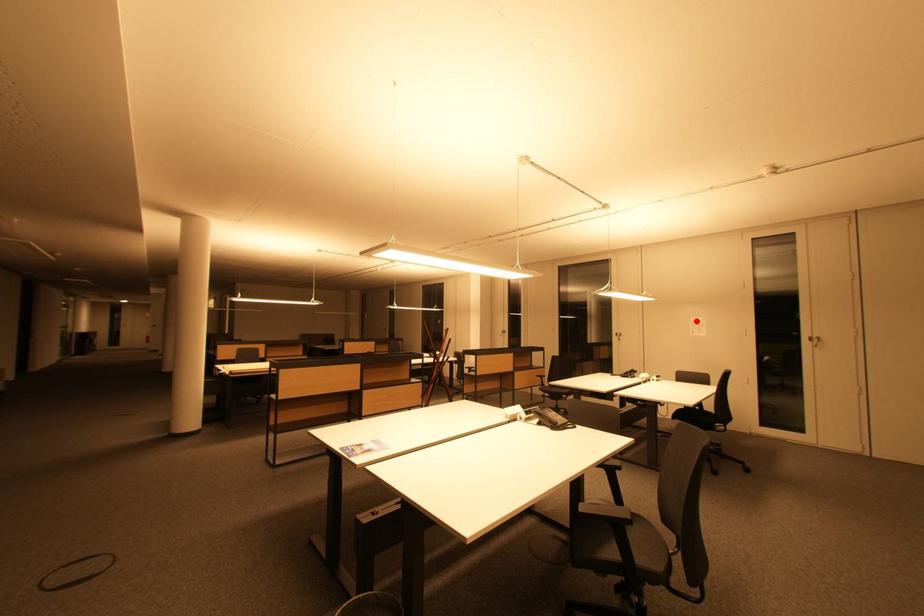
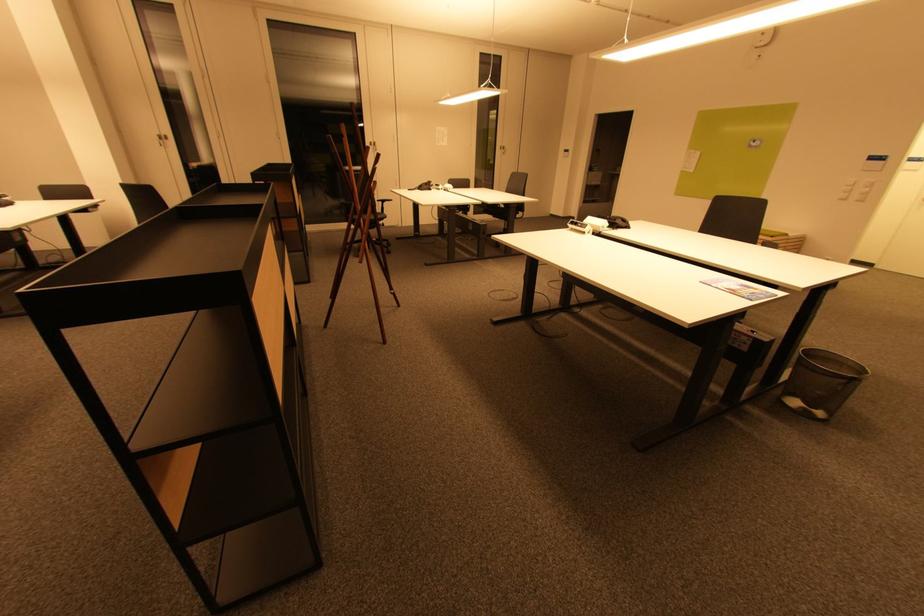
The point at the highlighted location is marked in the first image. Where is the corresponding point in the second image?

(442, 130)